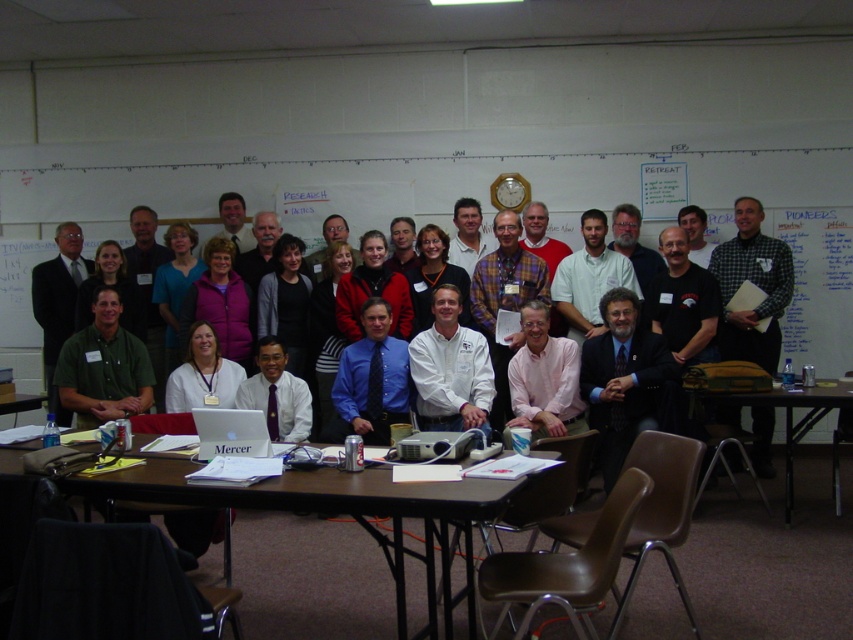
Between blue dress shirt at center and brown wooden table at lower left, which one has more height?

blue dress shirt at center

Who is higher up, blue dress shirt at center or brown wooden table at lower left?

blue dress shirt at center is above.

Does point (341, 404) lie in front of point (15, 401)?

No.

Locate an element on the screen. The height and width of the screenshot is (640, 853). blue dress shirt at center is located at coordinates (370, 378).

Who is higher up, white matte shirt at center or silver metallic laptop at center?

white matte shirt at center

Does white matte shirt at center appear on the left side of silver metallic laptop at center?

Incorrect, white matte shirt at center is not on the left side of silver metallic laptop at center.

Who is more forward, (x=434, y=355) or (x=230, y=452)?

Point (x=230, y=452) is in front.

The width and height of the screenshot is (853, 640). I want to click on white matte shirt at center, so click(450, 369).

Measure the distance between blue dress shirt at center and camera.

blue dress shirt at center is 4.74 meters away from camera.

Find the location of a particular element. This screenshot has width=853, height=640. blue dress shirt at center is located at coordinates (370, 378).